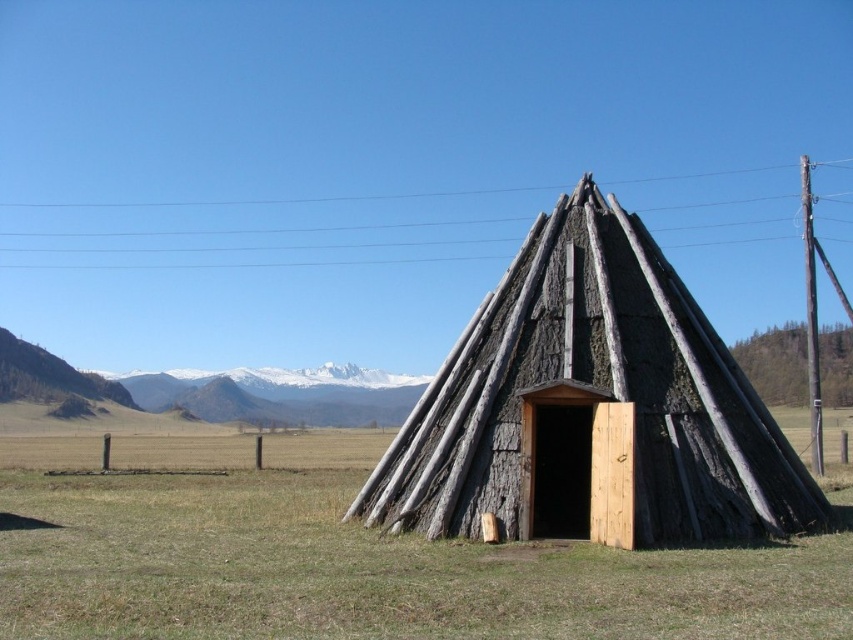
You are standing in the open field and see the green grass at center and the charred wood hut at center. Which object is taller?

The charred wood hut at center is taller than the green grass at center.

You are standing in front of the rustic wooden hut and notice two points marked on its roof. The first point is at coordinate point(277,486) and the second is at point(271,390). Which point is closer to you?

Point(277,486) is closer to the camera than point(271,390).